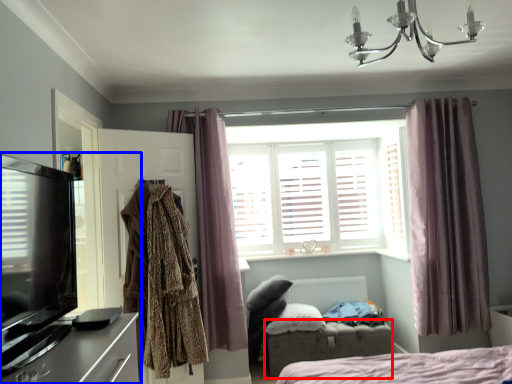
Question: Among these objects, which one is nearest to the camera, furniture (highlighted by a red box) or entertainment center (highlighted by a blue box)?

Choices:
 (A) furniture
 (B) entertainment center

Answer: (B)